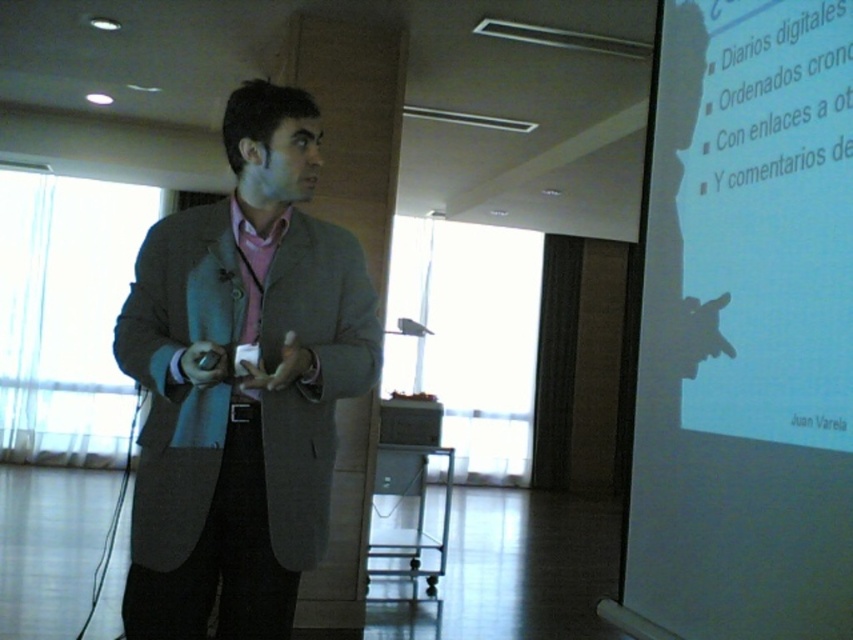
You are an event organizer setting up a presentation. You need to ensure the presenter can see the white matte projection screen at right while facing the audience. Given the positioning of the matte gray blazer at center, will the presenter be able to view the screen without turning their head?

The white matte projection screen at right is above the matte gray blazer at center, so the presenter wearing the matte gray blazer at center should be able to look up slightly to see the screen without needing to turn their head.

You are a technician setting up for a presentation. You have a white matte projection screen at right and a matte gray blazer at center. Which object is larger in size?

The white matte projection screen at right is bigger than the matte gray blazer at center.

You are a technician setting up for a presentation. You need to adjust the projector so the image appears on the white matte projection screen at right without overlapping the matte gray blazer at center. Based on the scene description, which object should be moved closer to the front?

The white matte projection screen at right is in front of the matte gray blazer at center, so the screen should be moved closer to the front to ensure it is positioned ahead of the presenter.